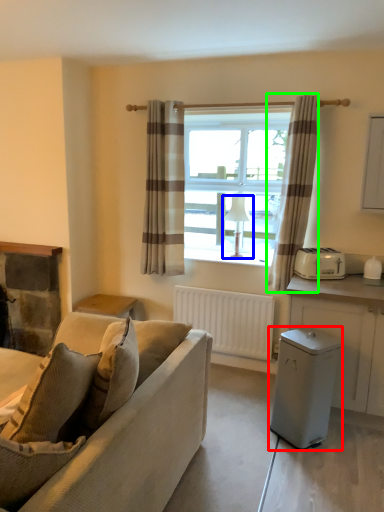
Question: Which is nearer to the appliance (highlighted by a red box)? lamp (highlighted by a blue box) or curtain (highlighted by a green box).

Choices:
 (A) lamp
 (B) curtain

Answer: (B)